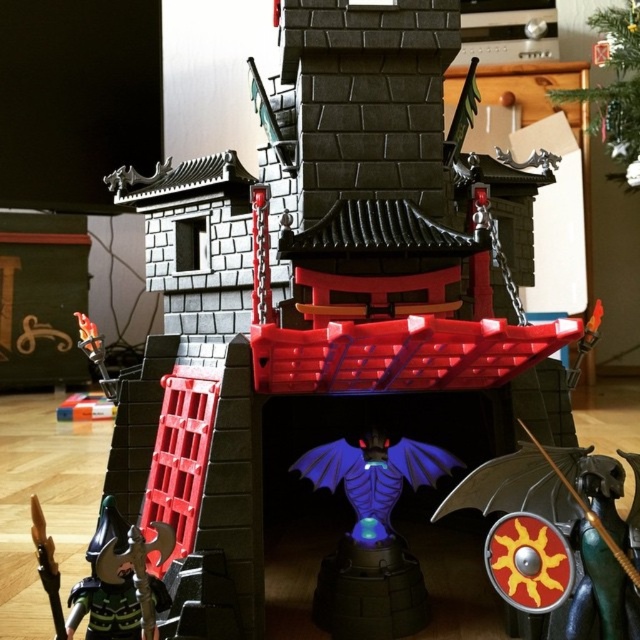
You are a knight preparing for battle in the castle. You see a shiny metallic shield at center and a black plastic axe at lower left. Which weapon can you use to block an incoming arrow more effectively?

The shiny metallic shield at center is bigger than the black plastic axe at lower left, so it can block an incoming arrow more effectively due to its larger size.

You are a toy collector who wants to place a small 10 cm tall knight figurine between the blue translucent dragon at center and the red bridge at lower right. Can you fit it there?

The distance between the blue translucent dragon at center and the red bridge at lower right is 94.62 centimeters, so the 10 cm tall knight figurine can easily fit in that space.

You are a knight in the castle and need to choose between the shiny metallic shield at center and the black plastic axe at lower left. Which object is taller?

The shiny metallic shield at center is taller than the black plastic axe at lower left.